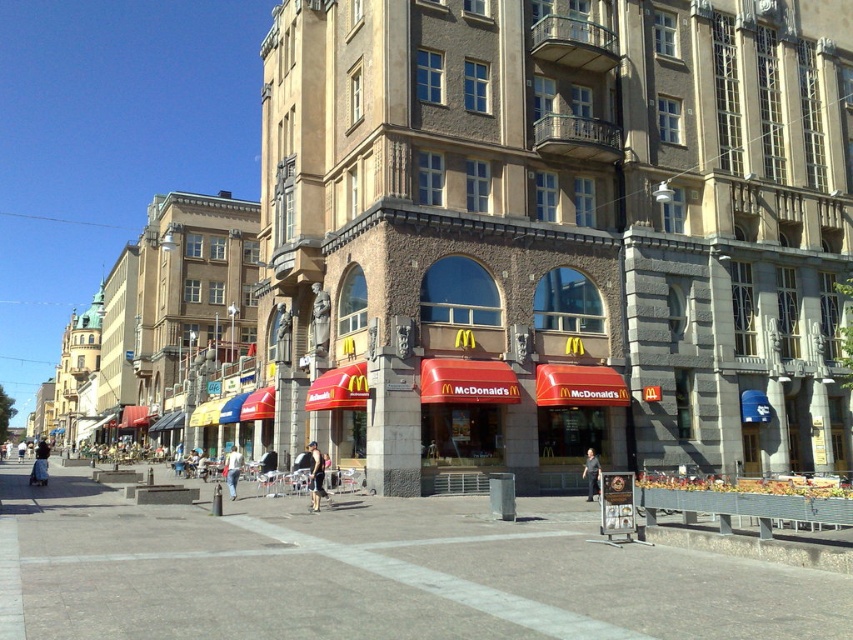
Question: Which object is positioned closest to the concrete plaza at center?

Choices:
 (A) denim pants at lower left
 (B) dark blue jeans at center
 (C) black fabric shorts at center
 (D) denim shorts at center

Answer: (C)

Question: Which of the following is the closest to the observer?

Choices:
 (A) denim pants at lower left
 (B) dark blue jeans at center
 (C) denim shorts at center
 (D) black fabric shorts at center

Answer: (D)

Question: Among these objects, which one is farthest from the camera?

Choices:
 (A) dark blue jeans at center
 (B) black fabric shorts at center
 (C) denim pants at lower left
 (D) denim shorts at center

Answer: (C)

Question: From the image, what is the correct spatial relationship of concrete plaza at center in relation to denim shorts at center?

Choices:
 (A) above
 (B) below

Answer: (A)

Question: Does denim pants at lower left appear on the right side of dark blue jeans at center?

Choices:
 (A) yes
 (B) no

Answer: (B)

Question: Does black fabric shorts at center have a greater width compared to denim pants at lower left?

Choices:
 (A) no
 (B) yes

Answer: (A)